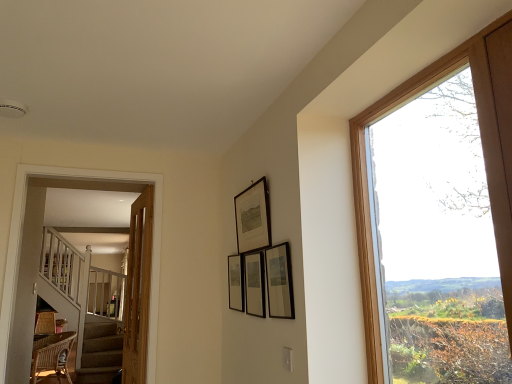
Identify the location of white wooden staircase at left. The height and width of the screenshot is (384, 512). (20, 249).

Measure the distance between matte black picture frame at upper center, arranged as the 4th picture frame when viewed from the back, and camera.

The distance of matte black picture frame at upper center, arranged as the 4th picture frame when viewed from the back, from camera is 1.74 meters.

At what (x,y) coordinates should I click in order to perform the action: click on wooden door at left. Please return your answer as a coordinate pair (x, y). This screenshot has height=384, width=512. Looking at the image, I should click on (138, 289).

How much space does wooden framed print at upper center, arranged as the third picture frame when viewed from the back, occupy vertically?

wooden framed print at upper center, arranged as the third picture frame when viewed from the back, is 13.57 inches in height.

The height and width of the screenshot is (384, 512). Describe the element at coordinates (253, 217) in the screenshot. I see `wooden framed print at upper center, which appears as the 2th picture frame when viewed from the front` at that location.

What do you see at coordinates (483, 153) in the screenshot? The image size is (512, 384). I see `clear glass window at right` at bounding box center [483, 153].

What is the approximate height of wicker chair at lower left?

The height of wicker chair at lower left is 19.35 inches.

What are the coordinates of `white wooden staircase at left` in the screenshot? It's located at (20, 249).

Who is shorter, matte black picture frame at center, arranged as the 4th picture frame when viewed from the front, or matte black picture frame at upper center, arranged as the 1th picture frame when viewed from the front?

Standing shorter between the two is matte black picture frame at upper center, arranged as the 1th picture frame when viewed from the front.

Which of these two, matte black picture frame at center, marked as the first picture frame in a back-to-front arrangement, or matte black picture frame at upper center, arranged as the 4th picture frame when viewed from the back, is smaller?

Smaller between the two is matte black picture frame at center, marked as the first picture frame in a back-to-front arrangement.

In order to click on the 3rd picture frame behind when counting from the matte black picture frame at upper center, arranged as the 1th picture frame when viewed from the front in this screenshot , I will do `click(236, 282)`.

Which point is more distant from viewer, (230, 260) or (285, 268)?

Positioned behind is point (230, 260).

Can we say matte black picture frame at center, the 3th picture frame viewed from the front, lies outside wooden door at left?

Absolutely, matte black picture frame at center, the 3th picture frame viewed from the front, is external to wooden door at left.

From the image's perspective, starting from the wooden door at left, which picture frame is the 2nd one above? Please provide its 2D coordinates.

[(254, 284)]

How many degrees apart are the facing directions of matte black picture frame at center, the 3th picture frame viewed from the front, and wooden door at left?

The facing directions of matte black picture frame at center, the 3th picture frame viewed from the front, and wooden door at left are 2.04 degrees apart.

Is wooden framed print at upper center, which appears as the 2th picture frame when viewed from the front, aimed at white wooden staircase at left?

No, wooden framed print at upper center, which appears as the 2th picture frame when viewed from the front, is not aimed at white wooden staircase at left.

From a real-world perspective, who is located lower, wooden framed print at upper center, arranged as the third picture frame when viewed from the back, or white wooden staircase at left?

From a 3D spatial view, white wooden staircase at left is below.

From the image's perspective, is wooden framed print at upper center, which appears as the 2th picture frame when viewed from the front, under white wooden staircase at left?

No.

Which object is positioned more to the left, wooden framed print at upper center, arranged as the third picture frame when viewed from the back, or white wooden staircase at left?

white wooden staircase at left is more to the left.

Is clear glass window at right situated inside wooden framed print at upper center, which appears as the 2th picture frame when viewed from the front, or outside?

clear glass window at right is not inside wooden framed print at upper center, which appears as the 2th picture frame when viewed from the front, it's outside.

From a real-world perspective, is clear glass window at right physically located above or below wooden framed print at upper center, which appears as the 2th picture frame when viewed from the front?

From a real-world perspective, clear glass window at right is physically below wooden framed print at upper center, which appears as the 2th picture frame when viewed from the front.

The width and height of the screenshot is (512, 384). Find the location of `window lying below the wooden framed print at upper center, which appears as the 2th picture frame when viewed from the front (from the image's perspective)`. window lying below the wooden framed print at upper center, which appears as the 2th picture frame when viewed from the front (from the image's perspective) is located at coordinates pyautogui.click(x=483, y=153).

Can you confirm if clear glass window at right is positioned to the right of wooden framed print at upper center, which appears as the 2th picture frame when viewed from the front?

Correct, you'll find clear glass window at right to the right of wooden framed print at upper center, which appears as the 2th picture frame when viewed from the front.

How different are the orientations of matte black picture frame at center, the 3th picture frame viewed from the front, and matte black picture frame at center, arranged as the 4th picture frame when viewed from the front, in degrees?

The angular difference between matte black picture frame at center, the 3th picture frame viewed from the front, and matte black picture frame at center, arranged as the 4th picture frame when viewed from the front, is 1.48 degrees.

Is point (248, 288) positioned before point (228, 283)?

That is True.

At what (x,y) coordinates should I click in order to perform the action: click on picture frame that is the 2nd one below the matte black picture frame at center, arranged as the 4th picture frame when viewed from the front (from a real-world perspective). Please return your answer as a coordinate pair (x, y). The image size is (512, 384). Looking at the image, I should click on (254, 284).

Looking at their sizes, would you say matte black picture frame at center, the 3th picture frame viewed from the front, is wider or thinner than matte black picture frame at center, arranged as the 4th picture frame when viewed from the front?

In the image, matte black picture frame at center, the 3th picture frame viewed from the front, appears to be wider than matte black picture frame at center, arranged as the 4th picture frame when viewed from the front.

Choose the correct answer: Is wooden door at left inside wicker chair at lower left or outside it?

The correct answer is: outside.

At what (x,y) coordinates should I click in order to perform the action: click on chair below the wooden door at left (from a real-world perspective). Please return your answer as a coordinate pair (x, y). Looking at the image, I should click on (52, 355).

Is wooden door at left turned away from wicker chair at lower left?

wooden door at left does not have its back to wicker chair at lower left.

Which object is further away from the camera taking this photo, wooden door at left or wicker chair at lower left?

wicker chair at lower left is further from the camera.

Is wooden door at left situated inside matte black picture frame at center, which appears as the 2th picture frame when viewed from the back, or outside?

wooden door at left is not inside matte black picture frame at center, which appears as the 2th picture frame when viewed from the back, it's outside.

Is point (141, 318) more distant than point (262, 252)?

Yes, point (141, 318) is behind point (262, 252).

Considering the sizes of wooden door at left and matte black picture frame at center, the 3th picture frame viewed from the front, in the image, is wooden door at left wider or thinner than matte black picture frame at center, the 3th picture frame viewed from the front,?

In the image, wooden door at left appears to be wider than matte black picture frame at center, the 3th picture frame viewed from the front.

Which picture frame is the 3rd one when counting from the front of the matte black picture frame at center, arranged as the 4th picture frame when viewed from the front? Please provide its 2D coordinates.

[(279, 282)]

From a real-world perspective, count 1st picture frames upward from the wooden door at left and point to it. Please provide its 2D coordinates.

[(254, 284)]

Considering their positions, is wicker chair at lower left positioned further to wooden door at left than clear glass window at right?

The object further to wooden door at left is wicker chair at lower left.

From the image, which object appears to be nearer to wooden door at left, white wooden staircase at left or matte black picture frame at center, marked as the first picture frame in a back-to-front arrangement?

white wooden staircase at left lies closer to wooden door at left than the other object.

Looking at the image, which one is located further to matte black picture frame at center, marked as the first picture frame in a back-to-front arrangement, wicker chair at lower left or wooden framed print at upper center, which appears as the 2th picture frame when viewed from the front?

wicker chair at lower left.

Estimate the real-world distances between objects in this image. Which object is further from clear glass window at right, matte black picture frame at center, the 3th picture frame viewed from the front, or wooden door at left?

Based on the image, wooden door at left appears to be further to clear glass window at right.

Based on their spatial positions, is wicker chair at lower left or wooden door at left further from white wooden staircase at left?

wicker chair at lower left is further to white wooden staircase at left.

Considering their positions, is wicker chair at lower left positioned further to matte black picture frame at upper center, arranged as the 4th picture frame when viewed from the back, than matte black picture frame at center, arranged as the 4th picture frame when viewed from the front?

wicker chair at lower left lies further to matte black picture frame at upper center, arranged as the 4th picture frame when viewed from the back, than the other object.

Considering their positions, is wicker chair at lower left positioned closer to wooden door at left than matte black picture frame at center, which appears as the 2th picture frame when viewed from the back?

matte black picture frame at center, which appears as the 2th picture frame when viewed from the back, is closer to wooden door at left.

Which object lies nearer to the anchor point wooden framed print at upper center, arranged as the third picture frame when viewed from the back, wicker chair at lower left or clear glass window at right?

clear glass window at right lies closer to wooden framed print at upper center, arranged as the third picture frame when viewed from the back, than the other object.

The height and width of the screenshot is (384, 512). Find the location of `door located between white wooden staircase at left and wicker chair at lower left in the depth direction`. door located between white wooden staircase at left and wicker chair at lower left in the depth direction is located at coordinates (x=138, y=289).

The width and height of the screenshot is (512, 384). What are the coordinates of `picture frame positioned between white wooden staircase at left and wicker chair at lower left from near to far` in the screenshot? It's located at (236, 282).

At what (x,y) coordinates should I click in order to perform the action: click on picture frame situated between white wooden staircase at left and wooden framed print at upper center, arranged as the third picture frame when viewed from the back, from left to right. Please return your answer as a coordinate pair (x, y). Looking at the image, I should click on (236, 282).

At what (x,y) coordinates should I click in order to perform the action: click on picture frame between clear glass window at right and wooden framed print at upper center, arranged as the third picture frame when viewed from the back, from front to back. Please return your answer as a coordinate pair (x, y). The height and width of the screenshot is (384, 512). Looking at the image, I should click on (279, 282).